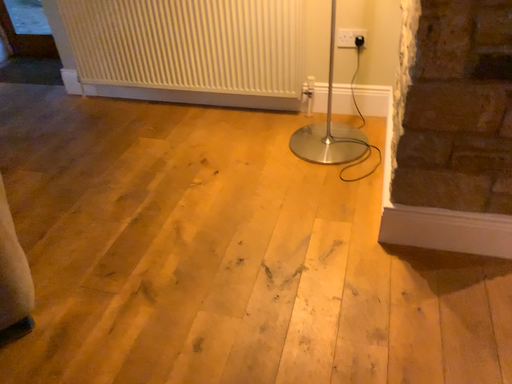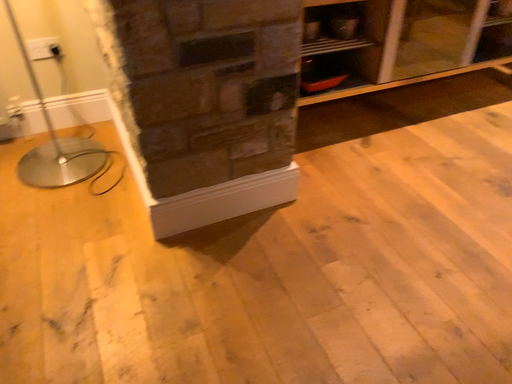
Question: Which way did the camera rotate in the video?

Choices:
 (A) rotated downward
 (B) rotated upward

Answer: (B)